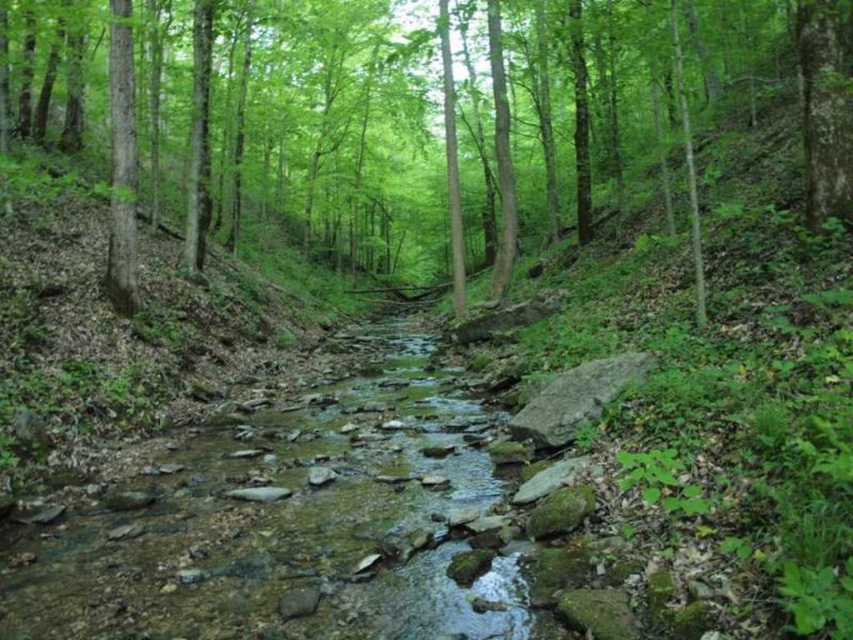
Measure the distance between green leafy tree at center and camera.

They are 45.55 feet apart.

How far apart are green leafy tree at center and clear water at stream center?

green leafy tree at center is 44.80 meters from clear water at stream center.

Which is behind, point (252, 115) or point (346, 392)?

Point (252, 115)

Identify the location of green leafy tree at center. Image resolution: width=853 pixels, height=640 pixels. (427, 108).